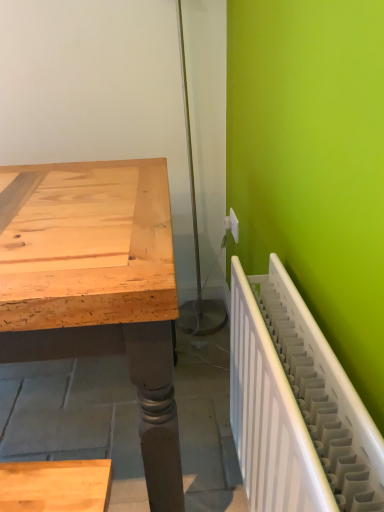
Image resolution: width=384 pixels, height=512 pixels. What do you see at coordinates (233, 225) in the screenshot? I see `white plastic electric outlet at upper right` at bounding box center [233, 225].

What is the approximate height of white plastic electric outlet at upper right?

3.58 inches.

Identify the location of white plastic electric outlet at upper right. The width and height of the screenshot is (384, 512). (233, 225).

Describe the element at coordinates (295, 406) in the screenshot. This screenshot has width=384, height=512. I see `white plastic radiator at lower right` at that location.

What are the coordinates of `white plastic radiator at lower right` in the screenshot? It's located at (295, 406).

The width and height of the screenshot is (384, 512). Find the location of `white plastic electric outlet at upper right`. white plastic electric outlet at upper right is located at coordinates [x=233, y=225].

Is white plastic radiator at lower right to the left of white plastic electric outlet at upper right from the viewer's perspective?

No, white plastic radiator at lower right is not to the left of white plastic electric outlet at upper right.

Is white plastic radiator at lower right in front of white plastic electric outlet at upper right?

Yes, it is in front of white plastic electric outlet at upper right.

Which point is more forward, [355,404] or [237,219]?

Point [355,404]

Based on the photo, from the image's perspective, is white plastic radiator at lower right over white plastic electric outlet at upper right?

Actually, white plastic radiator at lower right appears below white plastic electric outlet at upper right in the image.

From a real-world perspective, which is physically below, white plastic radiator at lower right or white plastic electric outlet at upper right?

From a 3D spatial view, white plastic radiator at lower right is below.

Is white plastic radiator at lower right wider than white plastic electric outlet at upper right?

Yes.

Considering the relative sizes of white plastic radiator at lower right and white plastic electric outlet at upper right in the image provided, is white plastic radiator at lower right shorter than white plastic electric outlet at upper right?

Incorrect, the height of white plastic radiator at lower right does not fall short of that of white plastic electric outlet at upper right.

Considering the relative sizes of white plastic radiator at lower right and white plastic electric outlet at upper right in the image provided, is white plastic radiator at lower right bigger than white plastic electric outlet at upper right?

Yes, white plastic radiator at lower right is bigger than white plastic electric outlet at upper right.

Is white plastic electric outlet at upper right a part of white plastic radiator at lower right?

No, white plastic electric outlet at upper right is not surrounded by white plastic radiator at lower right.

Would you consider white plastic radiator at lower right to be distant from white plastic electric outlet at upper right?

No, white plastic radiator at lower right is in close proximity to white plastic electric outlet at upper right.

Is white plastic radiator at lower right positioned with its back to white plastic electric outlet at upper right?

That's not correct — white plastic radiator at lower right is not looking away from white plastic electric outlet at upper right.

How different are the orientations of white plastic radiator at lower right and white plastic electric outlet at upper right in degrees?

1.15 degrees separate the facing orientations of white plastic radiator at lower right and white plastic electric outlet at upper right.

Where is `radiator that appears below the white plastic electric outlet at upper right (from a real-world perspective)`? This screenshot has width=384, height=512. radiator that appears below the white plastic electric outlet at upper right (from a real-world perspective) is located at coordinates (295, 406).

Which object is positioned more to the right, white plastic electric outlet at upper right or white plastic radiator at lower right?

white plastic radiator at lower right.

Which is behind, white plastic electric outlet at upper right or white plastic radiator at lower right?

white plastic electric outlet at upper right is further away from the camera.

Does point (230, 212) appear closer or farther from the camera than point (287, 501)?

Point (230, 212) appears to be farther away from the viewer than point (287, 501).

From the image's perspective, is white plastic electric outlet at upper right located above white plastic radiator at lower right?

Yes, from the image's perspective, white plastic electric outlet at upper right is above white plastic radiator at lower right.

From a real-world perspective, between white plastic electric outlet at upper right and white plastic radiator at lower right, who is vertically higher?

white plastic electric outlet at upper right is physically above.

Consider the image. Is white plastic electric outlet at upper right wider or thinner than white plastic radiator at lower right?

In the image, white plastic electric outlet at upper right appears to be more narrow than white plastic radiator at lower right.

Does white plastic electric outlet at upper right have a greater height compared to white plastic radiator at lower right?

No, white plastic electric outlet at upper right is not taller than white plastic radiator at lower right.

Which of these two, white plastic electric outlet at upper right or white plastic radiator at lower right, is smaller?

white plastic electric outlet at upper right is smaller.

Is white plastic electric outlet at upper right spatially inside white plastic radiator at lower right, or outside of it?

white plastic electric outlet at upper right is spatially situated outside white plastic radiator at lower right.

Is white plastic electric outlet at upper right not close to white plastic radiator at lower right?

No, white plastic electric outlet at upper right is not far from white plastic radiator at lower right.

Is white plastic electric outlet at upper right turned away from white plastic radiator at lower right?

No, white plastic electric outlet at upper right's orientation is not away from white plastic radiator at lower right.

How different are the orientations of white plastic electric outlet at upper right and white plastic radiator at lower right in degrees?

The facing directions of white plastic electric outlet at upper right and white plastic radiator at lower right are 1.15 degrees apart.

Looking at this image, could you measure the distance between white plastic electric outlet at upper right and white plastic radiator at lower right?

white plastic electric outlet at upper right is 29.53 inches away from white plastic radiator at lower right.

Locate an element on the screen. The image size is (384, 512). electric outlet behind the white plastic radiator at lower right is located at coordinates (233, 225).

Identify the location of radiator that appears in front of the white plastic electric outlet at upper right. This screenshot has height=512, width=384. (295, 406).

At what (x,y) coordinates should I click in order to perform the action: click on radiator below the white plastic electric outlet at upper right (from a real-world perspective). Please return your answer as a coordinate pair (x, y). This screenshot has height=512, width=384. Looking at the image, I should click on coord(295,406).